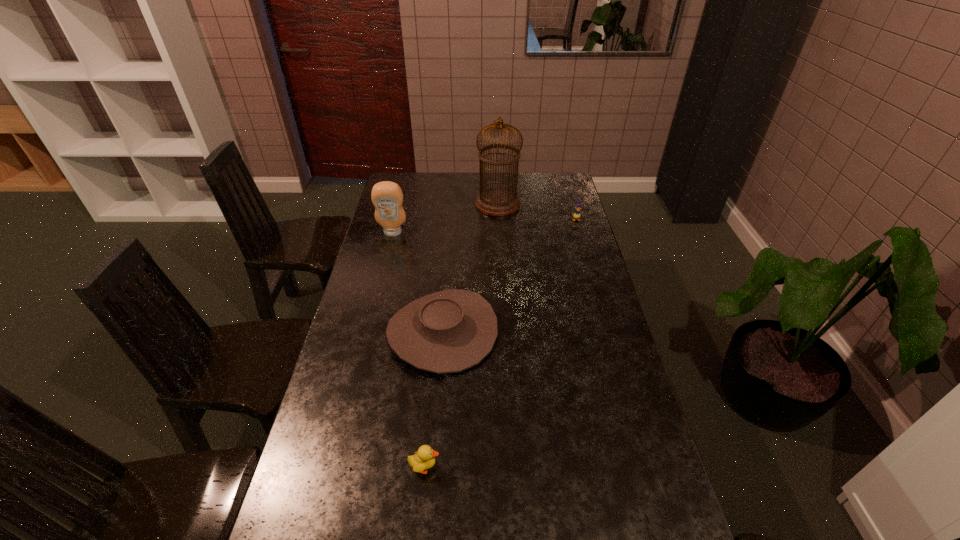
Locate an element on the screen. Image resolution: width=960 pixels, height=540 pixels. the farthest object is located at coordinates (497, 201).

Where is `birdcage`? Image resolution: width=960 pixels, height=540 pixels. birdcage is located at coordinates (497, 201).

This screenshot has width=960, height=540. In order to click on the fourth shortest object in this screenshot , I will do `click(387, 197)`.

This screenshot has height=540, width=960. I want to click on the leftmost object, so click(x=387, y=197).

Locate an element on the screen. Image resolution: width=960 pixels, height=540 pixels. cowboy hat is located at coordinates (449, 331).

Where is `the second farthest object`? The width and height of the screenshot is (960, 540). the second farthest object is located at coordinates (576, 215).

The image size is (960, 540). In order to click on the right duckling in this screenshot , I will do `click(576, 215)`.

Where is `the nearer duckling`? This screenshot has height=540, width=960. the nearer duckling is located at coordinates 424,459.

At what (x,y) coordinates should I click in order to perform the action: click on the nearest object. Please return your answer as a coordinate pair (x, y). Image resolution: width=960 pixels, height=540 pixels. Looking at the image, I should click on (424, 459).

Find the location of `vacant space located 0.050m on the front-facing side of the birdcage`. vacant space located 0.050m on the front-facing side of the birdcage is located at coordinates (465, 204).